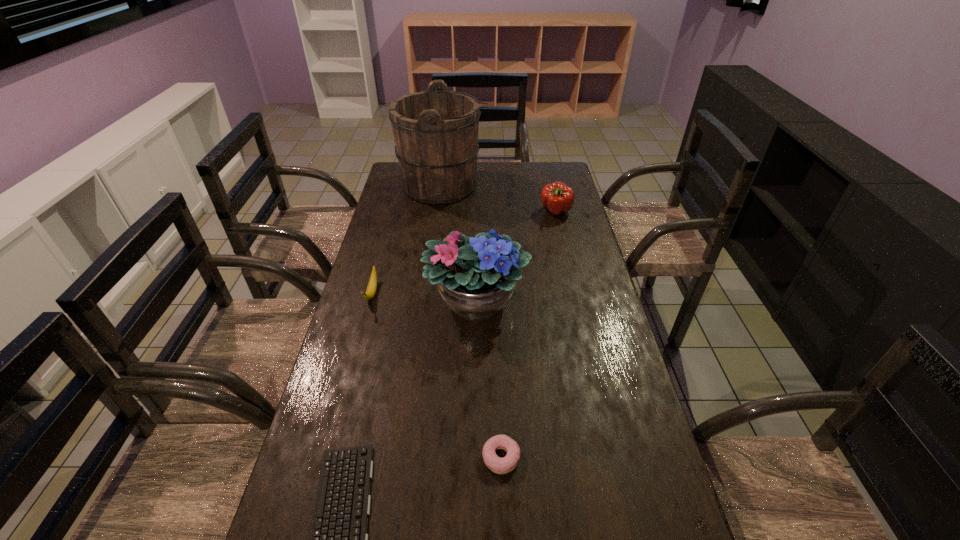
This screenshot has width=960, height=540. What are the coordinates of `vacant area located on the back of the doughnut` in the screenshot? It's located at (499, 416).

The height and width of the screenshot is (540, 960). I want to click on object that is at the far edge, so click(436, 132).

Image resolution: width=960 pixels, height=540 pixels. Identify the location of bucket positioned at the left edge. (436, 132).

This screenshot has height=540, width=960. Find the location of `banana positioned at the left edge`. banana positioned at the left edge is located at coordinates (372, 285).

In order to click on object at the right edge in this screenshot , I will do `click(558, 198)`.

Where is `object present at the far left corner`? object present at the far left corner is located at coordinates (x=436, y=132).

The height and width of the screenshot is (540, 960). What are the coordinates of `free location at the far edge` in the screenshot? It's located at pos(488,187).

This screenshot has width=960, height=540. In order to click on free space at the left edge in this screenshot , I will do `click(348, 340)`.

Where is `vacant space at the right edge`? The width and height of the screenshot is (960, 540). vacant space at the right edge is located at coordinates (609, 433).

Identify the location of free location at the far right corner. The width and height of the screenshot is (960, 540). (556, 166).